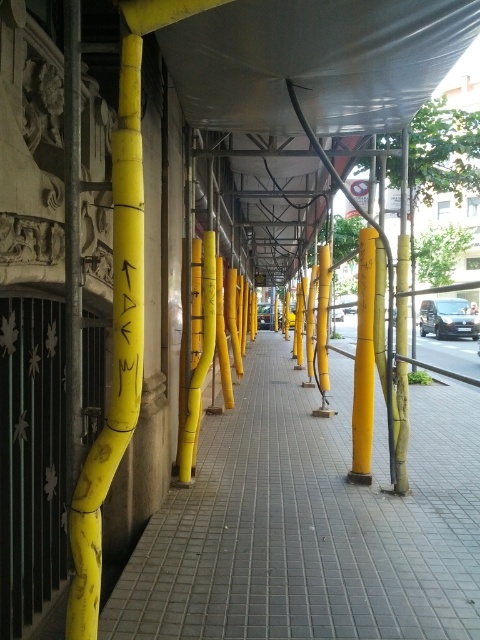
Question: Which object appears closest to the camera in this image?

Choices:
 (A) yellow matte pole at center
 (B) gray tile pavement at center

Answer: (B)

Question: Does yellow matte pole at center have a smaller size compared to black painted writing at center?

Choices:
 (A) yes
 (B) no

Answer: (B)

Question: Which of these objects is positioned farthest from the gray tile pavement at center?

Choices:
 (A) black painted writing at center
 (B) yellow matte pole at center

Answer: (A)

Question: Which object is positioned farthest from the black painted writing at center?

Choices:
 (A) gray tile pavement at center
 (B) yellow matte pole at center

Answer: (B)

Question: Can you confirm if yellow matte pole at center is positioned to the right of black painted writing at center?

Choices:
 (A) yes
 (B) no

Answer: (A)

Question: Is gray tile pavement at center above yellow matte pole at center?

Choices:
 (A) no
 (B) yes

Answer: (A)